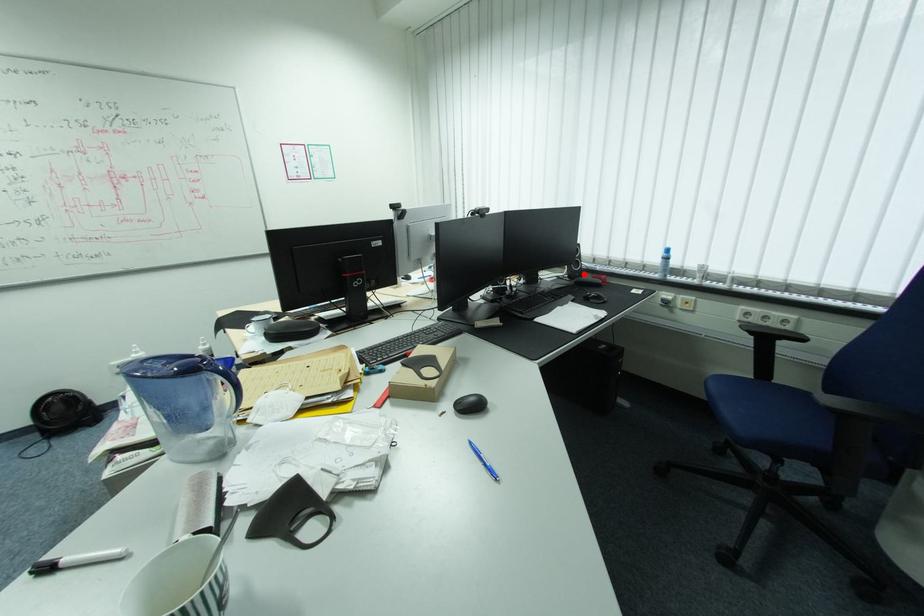
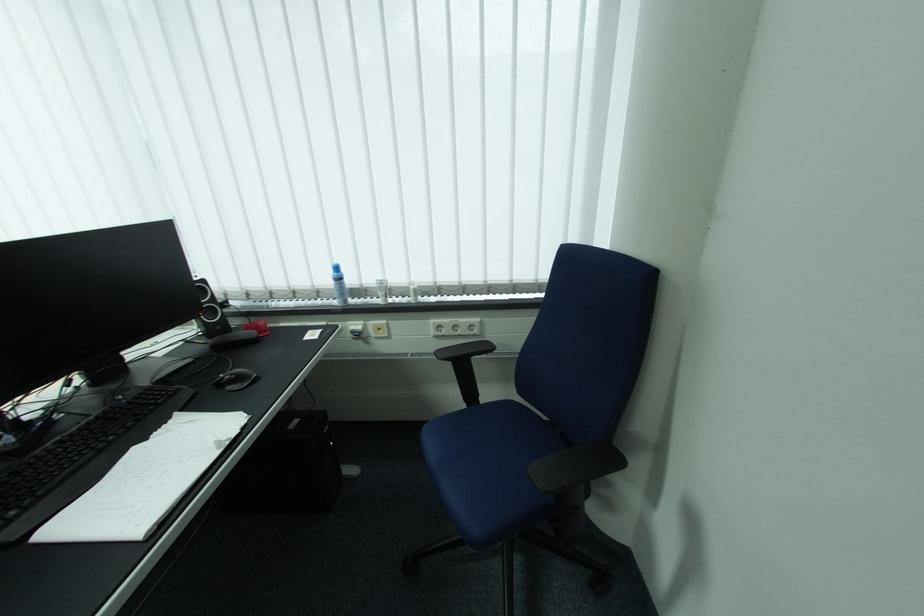
In the second image, find the point that corresponds to the highlighted location in the first image.

(225, 328)